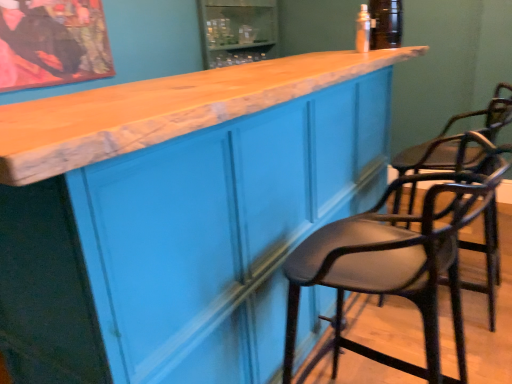
Question: Is matte blue cabinet at center with matte black bar stool at right, the 2th chair when ordered from back to front?

Choices:
 (A) yes
 (B) no

Answer: (B)

Question: Does matte blue cabinet at center have a smaller size compared to matte black bar stool at right, the 2th chair when ordered from back to front?

Choices:
 (A) yes
 (B) no

Answer: (B)

Question: From a real-world perspective, is matte blue cabinet at center on top of matte black bar stool at right, the 2th chair when ordered from back to front?

Choices:
 (A) yes
 (B) no

Answer: (A)

Question: Considering the relative sizes of matte blue cabinet at center and matte black bar stool at right, arranged as the first chair when viewed from the front, in the image provided, is matte blue cabinet at center shorter than matte black bar stool at right, arranged as the first chair when viewed from the front,?

Choices:
 (A) no
 (B) yes

Answer: (A)

Question: Is matte blue cabinet at center far from matte black bar stool at right, arranged as the first chair when viewed from the front?

Choices:
 (A) yes
 (B) no

Answer: (B)

Question: From a real-world perspective, is matte blue cabinet at center physically located above or below black leather chair at right, which appears as the first chair when viewed from the back?

Choices:
 (A) above
 (B) below

Answer: (A)

Question: Considering the relative positions of matte blue cabinet at center and black leather chair at right, which appears as the first chair when viewed from the back, in the image provided, is matte blue cabinet at center to the left or to the right of black leather chair at right, which appears as the first chair when viewed from the back,?

Choices:
 (A) right
 (B) left

Answer: (B)

Question: Is matte blue cabinet at center situated inside black leather chair at right, positioned as the 2th chair in front-to-back order, or outside?

Choices:
 (A) inside
 (B) outside

Answer: (B)

Question: Based on their sizes in the image, would you say matte blue cabinet at center is bigger or smaller than black leather chair at right, which appears as the first chair when viewed from the back?

Choices:
 (A) big
 (B) small

Answer: (A)

Question: From their relative heights in the image, would you say clear plastic bottle at upper center is taller or shorter than black leather chair at right, which appears as the first chair when viewed from the back?

Choices:
 (A) short
 (B) tall

Answer: (A)

Question: Visually, is clear plastic bottle at upper center positioned to the left or to the right of black leather chair at right, which appears as the first chair when viewed from the back?

Choices:
 (A) left
 (B) right

Answer: (A)

Question: In the image, is clear plastic bottle at upper center positioned in front of or behind black leather chair at right, positioned as the 2th chair in front-to-back order?

Choices:
 (A) behind
 (B) front

Answer: (A)

Question: From a real-world perspective, relative to black leather chair at right, which appears as the first chair when viewed from the back, is clear plastic bottle at upper center vertically above or below?

Choices:
 (A) below
 (B) above

Answer: (B)

Question: Considering their positions, is black leather chair at right, which appears as the first chair when viewed from the back, located in front of or behind matte black bar stool at right, the 2th chair when ordered from back to front?

Choices:
 (A) behind
 (B) front

Answer: (A)

Question: Is point (493, 311) closer or farther from the camera than point (396, 178)?

Choices:
 (A) closer
 (B) farther

Answer: (B)